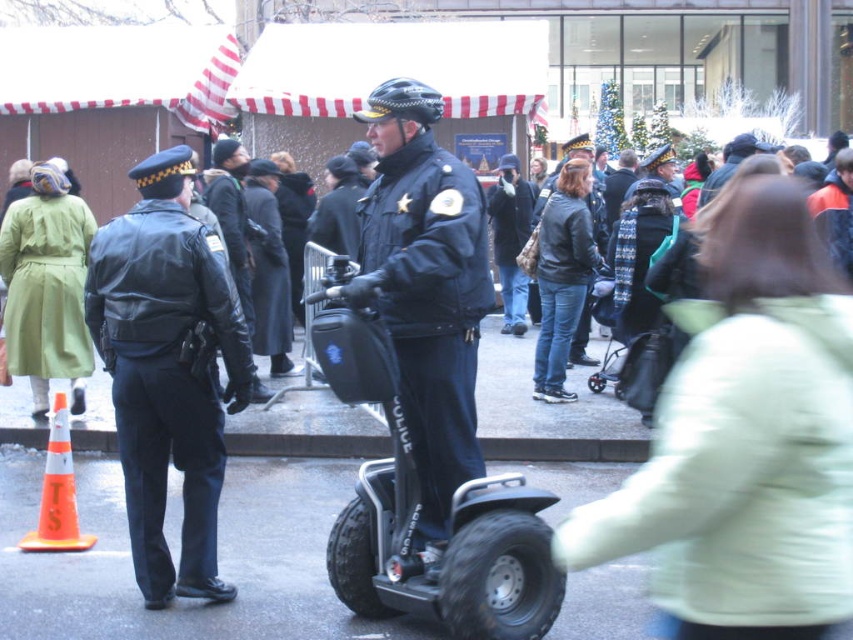
You are a photographer at the event and want to capture both the black leather jacket at left and the dark blue leather jacket at center in a single photo. Which jacket will appear closer to the camera in the photo?

The black leather jacket at left will appear closer to the camera because it is further to the viewer than the dark blue leather jacket at center.